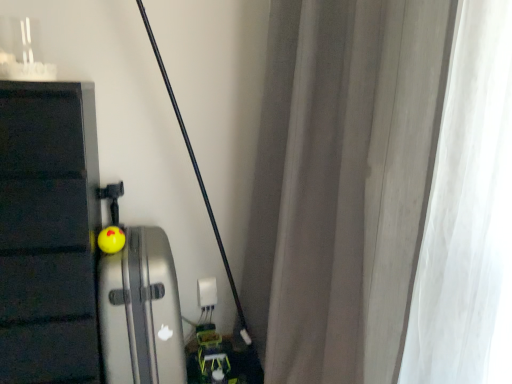
Question: From the image's perspective, is yellow rubber ball at center under white sheer curtain at right?

Choices:
 (A) yes
 (B) no

Answer: (A)

Question: Is white sheer curtain at right a part of yellow rubber ball at center?

Choices:
 (A) yes
 (B) no

Answer: (B)

Question: Considering the relative positions of yellow rubber ball at center and white sheer curtain at right in the image provided, is yellow rubber ball at center to the right of white sheer curtain at right from the viewer's perspective?

Choices:
 (A) yes
 (B) no

Answer: (B)

Question: Is yellow rubber ball at center touching white sheer curtain at right?

Choices:
 (A) yes
 (B) no

Answer: (B)

Question: Does yellow rubber ball at center lie behind white sheer curtain at right?

Choices:
 (A) yes
 (B) no

Answer: (A)

Question: Is yellow rubber ball at center bigger than white sheer curtain at right?

Choices:
 (A) yes
 (B) no

Answer: (B)

Question: Considering the relative sizes of yellow rubber ball at center and white plastic electric outlet at center in the image provided, is yellow rubber ball at center smaller than white plastic electric outlet at center?

Choices:
 (A) yes
 (B) no

Answer: (A)

Question: Can you confirm if yellow rubber ball at center is bigger than white plastic electric outlet at center?

Choices:
 (A) yes
 (B) no

Answer: (B)

Question: Are yellow rubber ball at center and white plastic electric outlet at center beside each other?

Choices:
 (A) no
 (B) yes

Answer: (A)

Question: Could you tell me if yellow rubber ball at center is facing white plastic electric outlet at center?

Choices:
 (A) no
 (B) yes

Answer: (A)

Question: Considering the relative sizes of yellow rubber ball at center and white plastic electric outlet at center in the image provided, is yellow rubber ball at center wider than white plastic electric outlet at center?

Choices:
 (A) no
 (B) yes

Answer: (B)

Question: Is yellow rubber ball at center positioned beyond the bounds of white plastic electric outlet at center?

Choices:
 (A) no
 (B) yes

Answer: (B)

Question: Considering the relative positions of white plastic electric outlet at center and white sheer curtain at right in the image provided, is white plastic electric outlet at center to the left of white sheer curtain at right from the viewer's perspective?

Choices:
 (A) no
 (B) yes

Answer: (B)